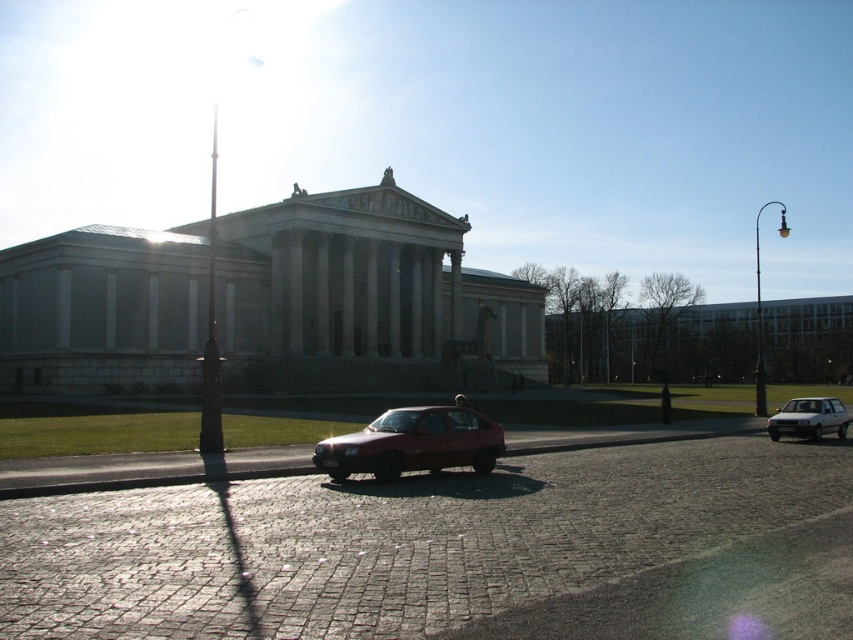
Between matte red car at center and silver metallic hatchback at right, which one is positioned higher?

Positioned higher is matte red car at center.

Is matte red car at center behind silver metallic hatchback at right?

No, matte red car at center is in front of silver metallic hatchback at right.

Between point (496, 456) and point (776, 433), which one is positioned in front?

Point (496, 456) is more forward.

Find the location of `matte red car at center`. matte red car at center is located at coordinates (413, 444).